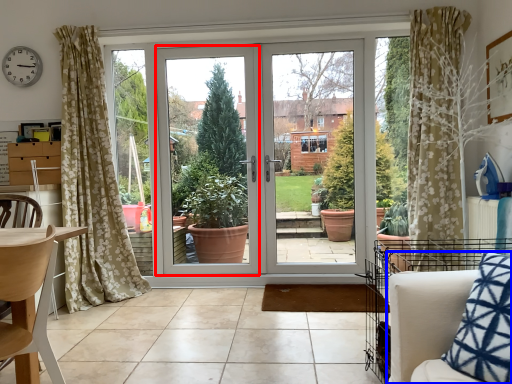
Question: Which point is closer to the camera, window frame (highlighted by a red box) or armchair (highlighted by a blue box)?

Choices:
 (A) window frame
 (B) armchair

Answer: (B)